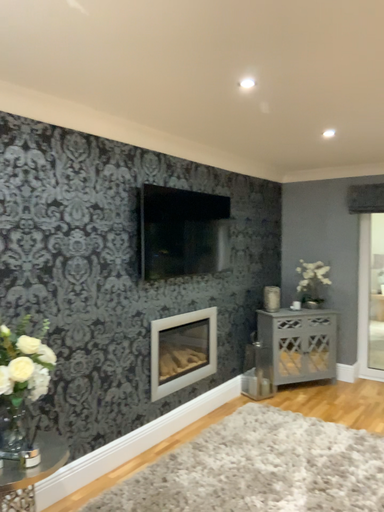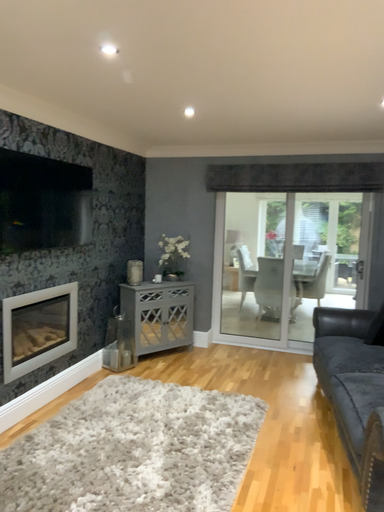
Question: Which way did the camera rotate in the video?

Choices:
 (A) rotated left
 (B) rotated right

Answer: (B)